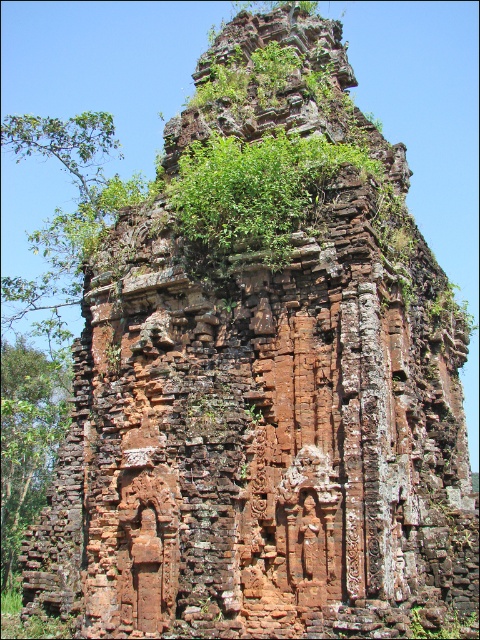
How distant is green leafy plant at center from green leafy tree at left?

98.95 meters

In the scene shown: Is green leafy plant at center in front of green leafy tree at left?

Yes, it is.

Which is in front, point (226, 202) or point (14, 412)?

Positioned in front is point (226, 202).

The height and width of the screenshot is (640, 480). Identify the location of green leafy plant at center. (255, 193).